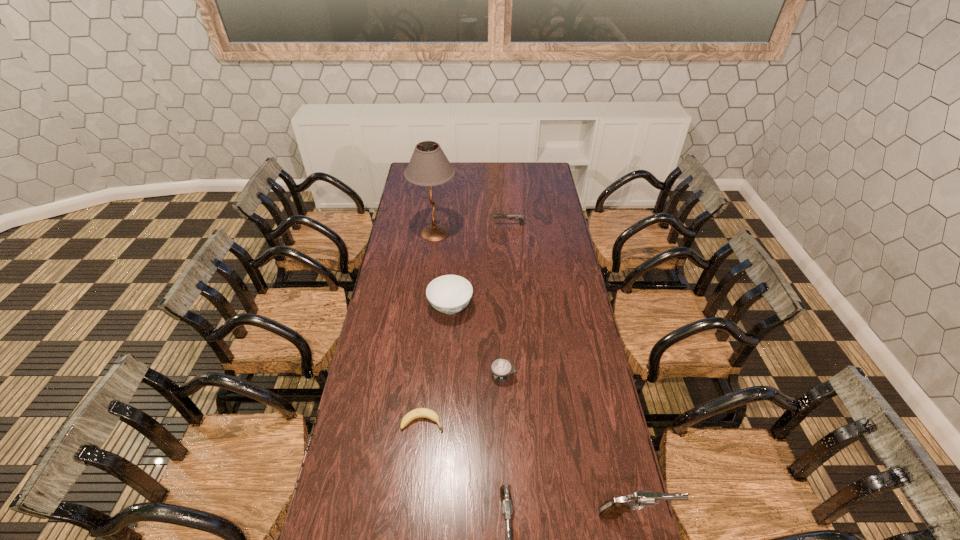
The pistols are evenly distributed in the image. To maintain this, where would you place another pistol on the left? Please point to a free space. Please provide its 2D coordinates. Your answer should be formatted as a tuple, i.e. [(x, y)], where the tuple contains the x and y coordinates of a point satisfying the conditions above.

[(373, 528)]